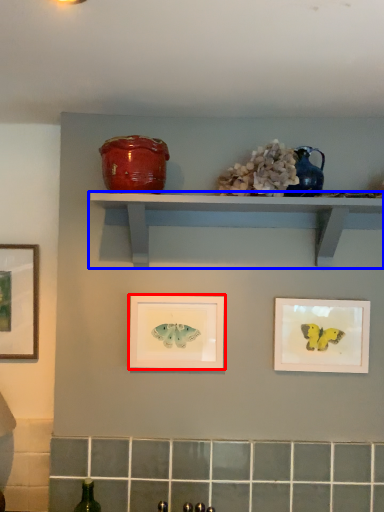
Question: Which of the following is the closest to the observer, picture frame (highlighted by a red box) or shelf (highlighted by a blue box)?

Choices:
 (A) picture frame
 (B) shelf

Answer: (B)